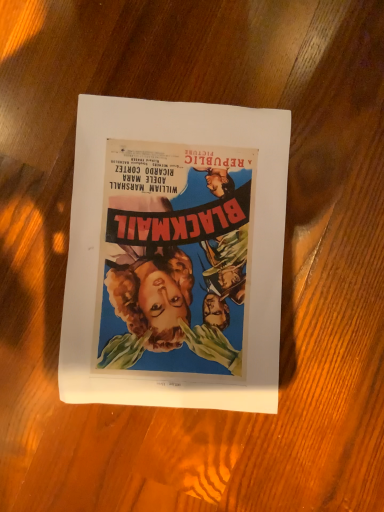
The image size is (384, 512). Find the location of `empty space that is ontop of vibrant paper poster at center (from a real-world perspective)`. empty space that is ontop of vibrant paper poster at center (from a real-world perspective) is located at coordinates (173, 248).